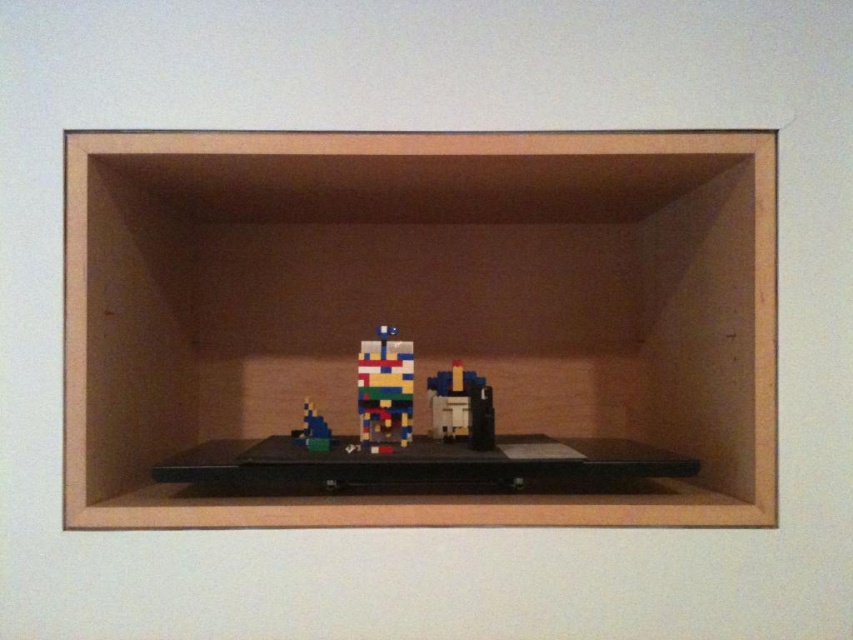
You are a delivery person who just arrived with a new package. The package contains a new multicolored plastic toy at center that needs to be placed on the wooden shelf at center. However, you notice something about their positions. Can you place the toy on the shelf as instructed?

The wooden shelf at center is positioned over the multicolored plastic toy at center, meaning the shelf is above the toy. To place the toy on the shelf, you would need to move the toy upwards to the shelf since it is currently below the shelf.